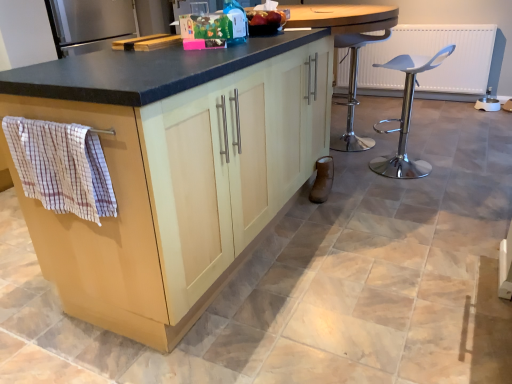
Question: Considering the relative sizes of white plastic stool at right and matte wood cabinet at left in the image provided, is white plastic stool at right thinner than matte wood cabinet at left?

Choices:
 (A) no
 (B) yes

Answer: (B)

Question: Is white plastic stool at right facing towards matte wood cabinet at left?

Choices:
 (A) yes
 (B) no

Answer: (B)

Question: Is the depth of white plastic stool at right greater than that of matte wood cabinet at left?

Choices:
 (A) no
 (B) yes

Answer: (B)

Question: Does white plastic stool at right contain matte wood cabinet at left?

Choices:
 (A) yes
 (B) no

Answer: (B)

Question: From a real-world perspective, is white plastic stool at right beneath matte wood cabinet at left?

Choices:
 (A) yes
 (B) no

Answer: (A)

Question: Is matte wood cabinet at left to the left or to the right of white plastic stool at right in the image?

Choices:
 (A) left
 (B) right

Answer: (A)

Question: From the image's perspective, relative to white plastic stool at right, is matte wood cabinet at left above or below?

Choices:
 (A) below
 (B) above

Answer: (A)

Question: Looking at their shapes, would you say matte wood cabinet at left is wider or thinner than white plastic stool at right?

Choices:
 (A) wide
 (B) thin

Answer: (A)

Question: Is point (308, 122) closer or farther from the camera than point (408, 97)?

Choices:
 (A) farther
 (B) closer

Answer: (B)

Question: Choose the correct answer: Is white plastic stool at right inside checkered fabric hand towel at left or outside it?

Choices:
 (A) outside
 (B) inside

Answer: (A)

Question: From the image's perspective, relative to checkered fabric hand towel at left, is white plastic stool at right above or below?

Choices:
 (A) below
 (B) above

Answer: (B)

Question: From their relative heights in the image, would you say white plastic stool at right is taller or shorter than checkered fabric hand towel at left?

Choices:
 (A) tall
 (B) short

Answer: (A)

Question: From a real-world perspective, relative to checkered fabric hand towel at left, is white plastic stool at right vertically above or below?

Choices:
 (A) below
 (B) above

Answer: (A)

Question: Does point (27, 76) appear closer or farther from the camera than point (87, 218)?

Choices:
 (A) closer
 (B) farther

Answer: (B)

Question: From their relative heights in the image, would you say matte wood cabinet at left is taller or shorter than checkered fabric hand towel at left?

Choices:
 (A) tall
 (B) short

Answer: (A)